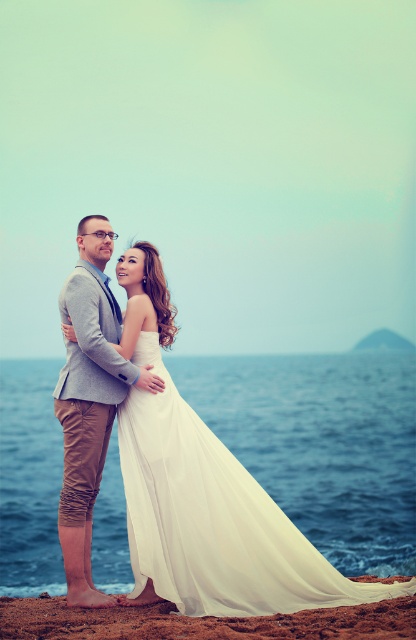
Question: Estimate the real-world distances between objects in this image. Which object is farther from the white chiffon dress at center?

Choices:
 (A) light gray textured blazer at center
 (B) brown sand at lower center

Answer: (A)

Question: Is white chiffon dress at center below brown sand at lower center?

Choices:
 (A) yes
 (B) no

Answer: (A)

Question: Which point is farther to the camera?

Choices:
 (A) brown sand at lower center
 (B) light gray textured blazer at center

Answer: (B)

Question: Which point appears closest to the camera in this image?

Choices:
 (A) (121, 458)
 (B) (118, 392)
 (C) (52, 627)

Answer: (C)

Question: Can you confirm if light gray textured blazer at center is positioned below brown sand at lower center?

Choices:
 (A) yes
 (B) no

Answer: (B)

Question: Does white chiffon dress at center appear under brown sand at lower center?

Choices:
 (A) yes
 (B) no

Answer: (A)